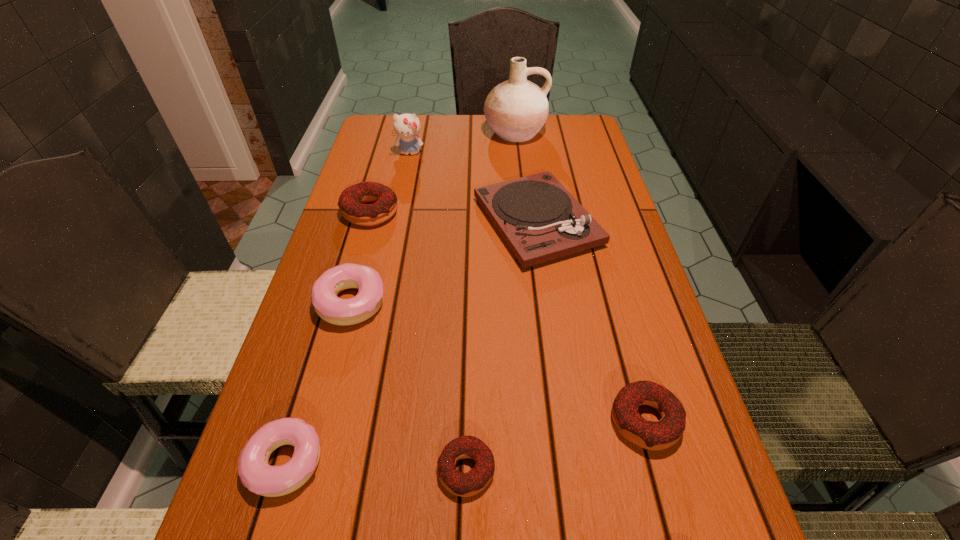
At what (x,y) coordinates should I click in order to perform the action: click on free spot between the fourth nearest doughnut and the phonograph_record. Please return your answer as a coordinate pair (x, y). Looking at the image, I should click on (444, 262).

Where is `object that is the fourth closest to the second chocolate doughnut from right to left`? The image size is (960, 540). object that is the fourth closest to the second chocolate doughnut from right to left is located at coordinates (537, 217).

Identify the location of the sixth closest object to the rightmost chocolate doughnut. (516, 110).

Find the location of a particular element. The height and width of the screenshot is (540, 960). the third closest doughnut to the second smallest chocolate doughnut is located at coordinates (256, 474).

Locate an element on the screen. This screenshot has height=540, width=960. doughnut that is the fourth closest one to the leftmost chocolate doughnut is located at coordinates (662, 434).

Locate an element on the screen. chocolate doughnut that is the second closest one to the rightmost doughnut is located at coordinates (x=351, y=200).

Locate which chocolate doughnut ranks third in proximity to the smaller pink doughnut. Please provide its 2D coordinates. Your answer should be formatted as a tuple, i.e. [(x, y)], where the tuple contains the x and y coordinates of a point satisfying the conditions above.

[(351, 200)]

Choose which pink doughnut is the second nearest neighbor to the pottery. Please provide its 2D coordinates. Your answer should be formatted as a tuple, i.e. [(x, y)], where the tuple contains the x and y coordinates of a point satisfying the conditions above.

[(256, 474)]

Find the location of `pink doughnut that is the closest one to the pottery`. pink doughnut that is the closest one to the pottery is located at coordinates (332, 309).

Find the location of `free space that satisfies the following two spatial constraints: 1. on the front-facing side of the kitten; 2. on the right side of the phonograph_record`. free space that satisfies the following two spatial constraints: 1. on the front-facing side of the kitten; 2. on the right side of the phonograph_record is located at coordinates (396, 222).